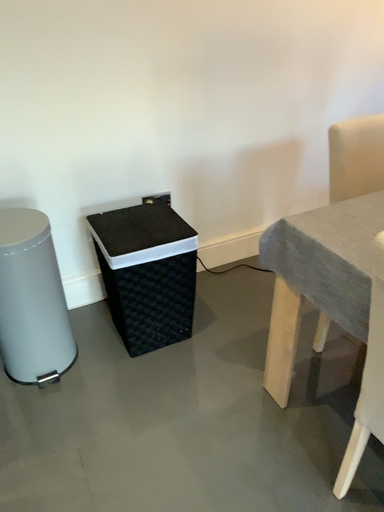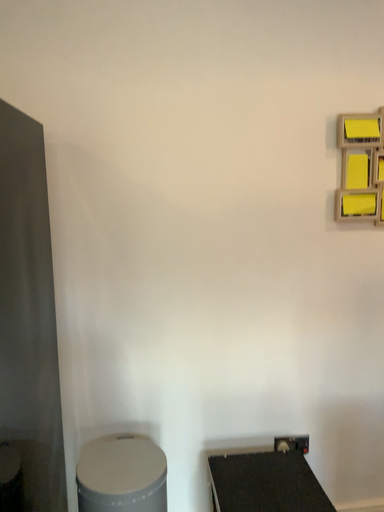
Question: How did the camera likely rotate when shooting the video?

Choices:
 (A) rotated left
 (B) rotated right

Answer: (A)